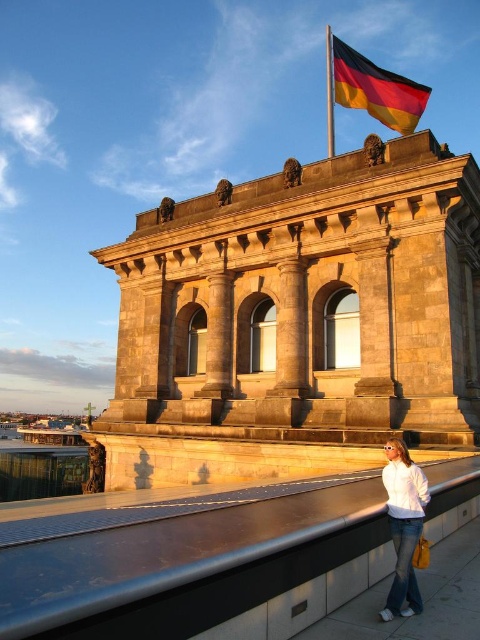
You are standing at the base of the historic building and notice two points marked on the facade. One is at coordinate point (342, 84) and the other at point (400, 445). If you were to walk towards the building, which coordinate point would appear closer to you initially?

Point (400, 445) would appear closer to you initially because it is in front of point (342, 84) according to their spatial relationship.

You are standing in front of the historic building and want to walk from the point at coordinates point (x=231, y=605) to the point at coordinates point (x=418, y=472). Will you be moving towards the building or away from it?

Since point (x=231, y=605) is in front of point (x=418, y=472), moving from the former to the latter would mean moving away from the building.